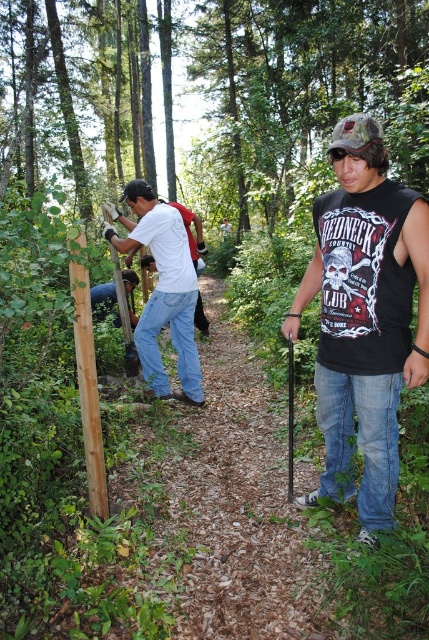
You are a photographer positioned at the edge of the dirt path. You want to capture both the black sleeveless shirt at center and the matte white shirt at center in a single frame. Which subject should you position closer to the left side of the camera viewfinder to ensure both are visible?

To ensure both the black sleeveless shirt at center and the matte white shirt at center are visible in the frame, position the matte white shirt at center closer to the left side of the camera viewfinder since the black sleeveless shirt at center is already to the right of it.